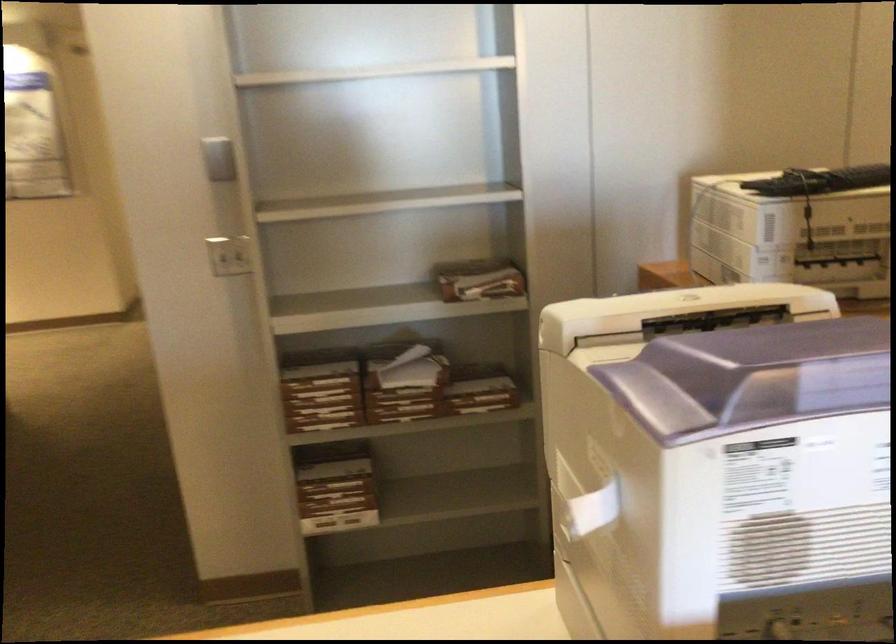
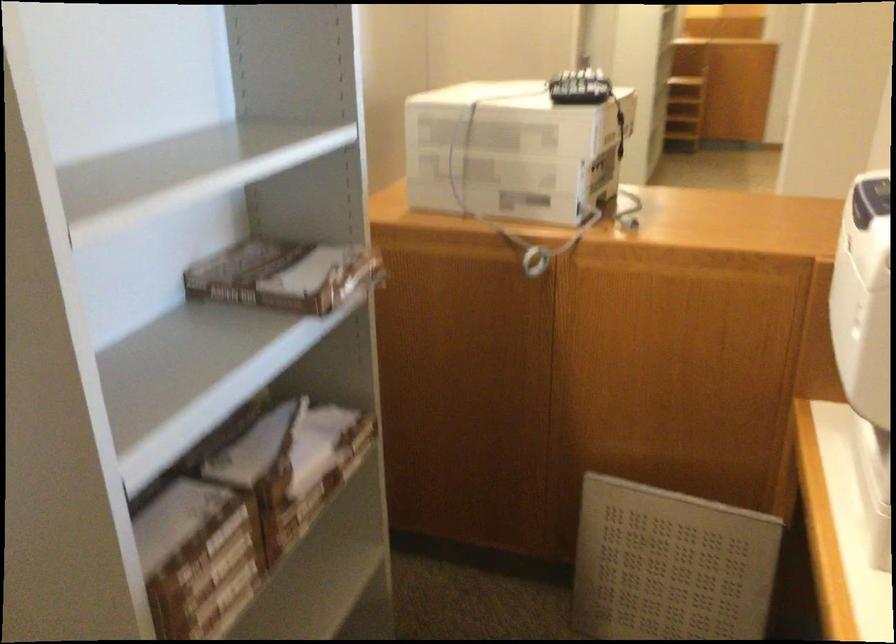
The point at [469,270] is marked in the first image. Where is the corresponding point in the second image?

(280, 275)